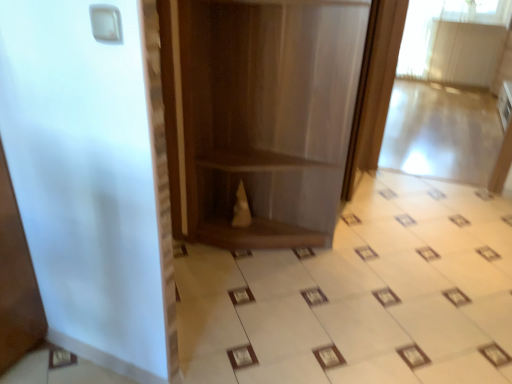
Measure the distance between point (293, 378) and camera.

Point (293, 378) is 1.64 meters away from camera.

What do you see at coordinates (359, 295) in the screenshot? The width and height of the screenshot is (512, 384). I see `white glossy ceramic tile at center` at bounding box center [359, 295].

The height and width of the screenshot is (384, 512). In order to click on white glossy ceramic tile at center in this screenshot , I will do `click(359, 295)`.

In order to click on matte brown bookshelf at center in this screenshot , I will do `click(261, 116)`.

Describe the element at coordinates (261, 116) in the screenshot. I see `matte brown bookshelf at center` at that location.

Locate an element on the screen. white glossy ceramic tile at center is located at coordinates (359, 295).

Considering the relative positions of matte brown bookshelf at center and white glossy ceramic tile at center in the image provided, is matte brown bookshelf at center to the left of white glossy ceramic tile at center from the viewer's perspective?

Yes, matte brown bookshelf at center is to the left of white glossy ceramic tile at center.

Is matte brown bookshelf at center further to camera compared to white glossy ceramic tile at center?

Yes.

Considering the positions of point (198, 196) and point (242, 331), is point (198, 196) closer or farther from the camera than point (242, 331)?

Point (198, 196).

From the image's perspective, who appears lower, matte brown bookshelf at center or white glossy ceramic tile at center?

white glossy ceramic tile at center.

From a real-world perspective, is matte brown bookshelf at center on white glossy ceramic tile at center?

Yes, from a real-world perspective, matte brown bookshelf at center is over white glossy ceramic tile at center

Can you confirm if matte brown bookshelf at center is wider than white glossy ceramic tile at center?

No.

Who is shorter, matte brown bookshelf at center or white glossy ceramic tile at center?

white glossy ceramic tile at center is shorter.

Who is bigger, matte brown bookshelf at center or white glossy ceramic tile at center?

matte brown bookshelf at center.

Is white glossy ceramic tile at center surrounded by matte brown bookshelf at center?

That's incorrect, white glossy ceramic tile at center is not inside matte brown bookshelf at center.

Is there a large distance between matte brown bookshelf at center and white glossy ceramic tile at center?

Actually, matte brown bookshelf at center and white glossy ceramic tile at center are a little close together.

Is matte brown bookshelf at center turned away from white glossy ceramic tile at center?

That's not correct — matte brown bookshelf at center is not looking away from white glossy ceramic tile at center.

What's the angular difference between matte brown bookshelf at center and white glossy ceramic tile at center's facing directions?

The angular difference between matte brown bookshelf at center and white glossy ceramic tile at center is 88.5 degrees.

The height and width of the screenshot is (384, 512). I want to click on ceramic tile below the matte brown bookshelf at center (from the image's perspective), so click(359, 295).

Based on their positions, is white glossy ceramic tile at center located to the left or right of matte brown bookshelf at center?

white glossy ceramic tile at center is positioned on matte brown bookshelf at center's right side.

Is the position of white glossy ceramic tile at center less distant than that of matte brown bookshelf at center?

Yes, the depth of white glossy ceramic tile at center is less than that of matte brown bookshelf at center.

Is point (316, 341) closer to viewer compared to point (225, 132)?

Yes, it is.

From the image's perspective, which one is positioned higher, white glossy ceramic tile at center or matte brown bookshelf at center?

matte brown bookshelf at center.

From a real-world perspective, is white glossy ceramic tile at center physically located above or below matte brown bookshelf at center?

white glossy ceramic tile at center is situated lower than matte brown bookshelf at center in the real world.

Can you confirm if white glossy ceramic tile at center is thinner than matte brown bookshelf at center?

No, white glossy ceramic tile at center is not thinner than matte brown bookshelf at center.

Between white glossy ceramic tile at center and matte brown bookshelf at center, which one has more height?

matte brown bookshelf at center.

Considering the relative sizes of white glossy ceramic tile at center and matte brown bookshelf at center in the image provided, is white glossy ceramic tile at center bigger than matte brown bookshelf at center?

No.

Is matte brown bookshelf at center surrounded by white glossy ceramic tile at center?

No, white glossy ceramic tile at center does not contain matte brown bookshelf at center.

Is white glossy ceramic tile at center next to matte brown bookshelf at center?

No, white glossy ceramic tile at center is not with matte brown bookshelf at center.

Is white glossy ceramic tile at center oriented towards matte brown bookshelf at center?

No, white glossy ceramic tile at center is not oriented towards matte brown bookshelf at center.

Identify the location of ceramic tile that is under the matte brown bookshelf at center (from a real-world perspective). Image resolution: width=512 pixels, height=384 pixels. (359, 295).

You are a GUI agent. You are given a task and a screenshot of the screen. Output one action in this format:
    pyautogui.click(x=<x>, y=<y>)
    Task: Click on the ceramic tile on the right side of matte brown bookshelf at center
    The width and height of the screenshot is (512, 384).
    Given the screenshot: What is the action you would take?
    pyautogui.click(x=359, y=295)

Where is `bookshelf above the white glossy ceramic tile at center (from the image's perspective)`? This screenshot has height=384, width=512. bookshelf above the white glossy ceramic tile at center (from the image's perspective) is located at coordinates (261, 116).